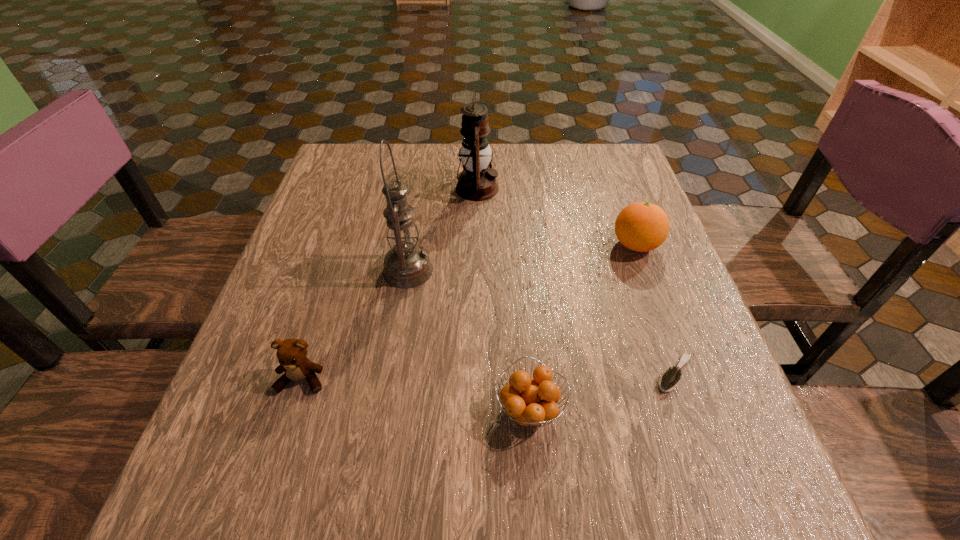
Find the location of `oil lamp`. oil lamp is located at coordinates (406, 265).

Identify the location of the fifth shortest object. (477, 182).

The height and width of the screenshot is (540, 960). In order to click on the farthest object in this screenshot , I will do `click(477, 182)`.

In order to click on the taller orange fruit in this screenshot , I will do `click(641, 227)`.

Image resolution: width=960 pixels, height=540 pixels. I want to click on the farther orange fruit, so click(x=641, y=227).

Identify the location of teddy bear. The height and width of the screenshot is (540, 960). (291, 353).

The width and height of the screenshot is (960, 540). Identify the location of the second shortest object. (536, 404).

At what (x,y) coordinates should I click in order to perform the action: click on the nearer orange fruit. Please return your answer as a coordinate pair (x, y). Looking at the image, I should click on (536, 404).

At what (x,y) coordinates should I click in order to perform the action: click on scrubbing brush. Please return your answer as a coordinate pair (x, y). Image resolution: width=960 pixels, height=540 pixels. Looking at the image, I should click on (670, 379).

Where is `free location located on the front of the oil lamp`? free location located on the front of the oil lamp is located at coordinates (376, 469).